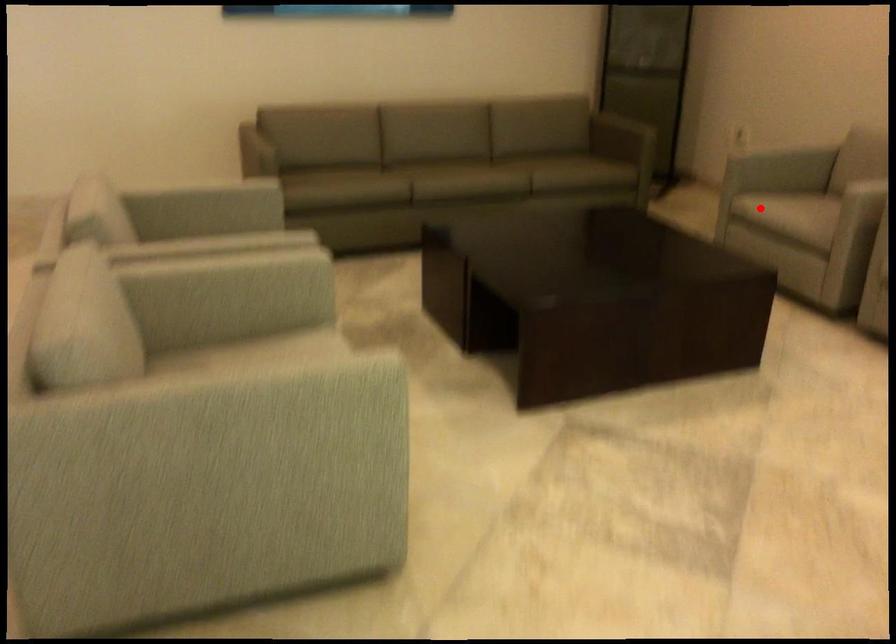
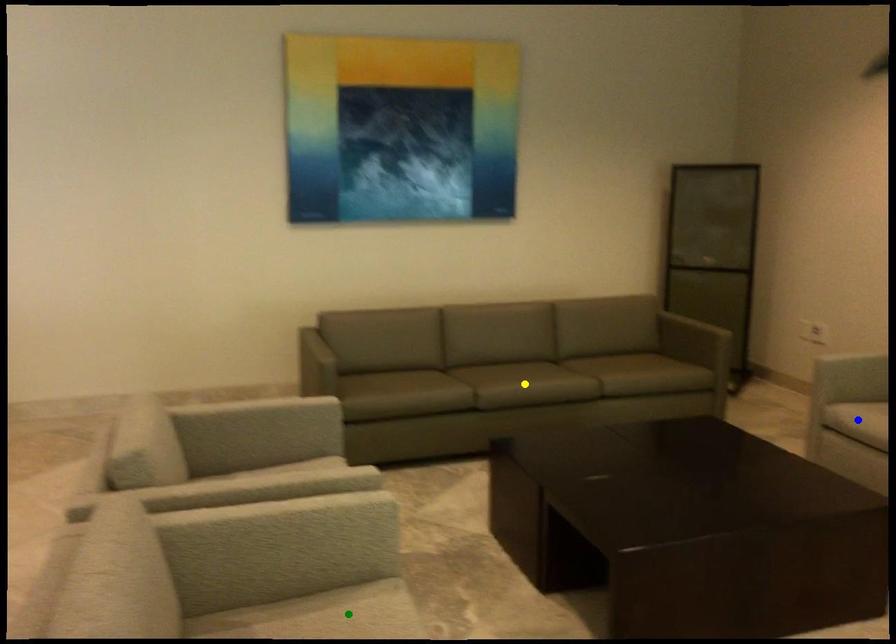
Question: I am providing you with two images of the same scene from different viewpoints. A red point is marked on the first image. You are given multiple points on the second image. Which mark in image 2 goes with the point in image 1?

Choices:
 (A) green point
 (B) blue point
 (C) yellow point

Answer: (B)